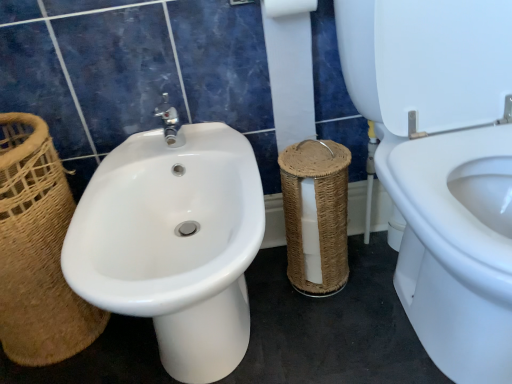
Describe the element at coordinates (456, 247) in the screenshot. The height and width of the screenshot is (384, 512). I see `white glossy bidet at left` at that location.

This screenshot has width=512, height=384. In order to click on woven brown basket at center in this screenshot , I will do `click(316, 215)`.

The height and width of the screenshot is (384, 512). What are the coordinates of `white glossy bidet at left` in the screenshot? It's located at pos(456,247).

From a real-world perspective, is white glossy bidet at center positioned over brown wicker basket at left based on gravity?

Actually, white glossy bidet at center is physically below brown wicker basket at left in the real world.

Looking at their sizes, would you say white glossy bidet at center is wider or thinner than brown wicker basket at left?

In the image, white glossy bidet at center appears to be wider than brown wicker basket at left.

Consider the image. Between white glossy bidet at center and brown wicker basket at left, which one appears on the right side from the viewer's perspective?

Positioned to the right is white glossy bidet at center.

Considering the positions of objects white glossy bidet at center and brown wicker basket at left in the image provided, who is behind, white glossy bidet at center or brown wicker basket at left?

brown wicker basket at left is more distant.

Which is behind, point (16, 237) or point (488, 352)?

Point (16, 237)

From a real-world perspective, who is located lower, brown wicker basket at left or white glossy bidet at left?

brown wicker basket at left, from a real-world perspective.

How much distance is there between brown wicker basket at left and white glossy bidet at left?

brown wicker basket at left and white glossy bidet at left are 77.49 centimeters apart.

How different are the orientations of brown wicker basket at left and white glossy bidet at left in degrees?

They differ by 1.55 degrees in their facing directions.

From the image's perspective, relative to white glossy bidet at center, is white paper at center above or below?

white paper at center is above white glossy bidet at center.

Considering the points (303, 60) and (166, 317), which point is in front, point (303, 60) or point (166, 317)?

The point (166, 317) is more forward.

Which object is further away from the camera, white paper at center or white glossy bidet at center?

white paper at center is more distant.

Which of these two, white paper at center or white glossy bidet at center, is wider?

white glossy bidet at center is wider.

From the image's perspective, which one is positioned higher, white glossy bidet at center or woven brown basket at center?

woven brown basket at center appears higher in the image.

Between white glossy bidet at center and woven brown basket at center, which one is positioned behind?

woven brown basket at center.

From a real-world perspective, which is physically above, white glossy bidet at center or woven brown basket at center?

In real-world perspective, white glossy bidet at center is above.

Consider the image. Is white glossy bidet at left facing away from woven brown basket at center?

white glossy bidet at left does not have its back to woven brown basket at center.

From the image's perspective, is white glossy bidet at left on top of woven brown basket at center?

Yes, from the image's perspective, white glossy bidet at left is on top of woven brown basket at center.

Which object is positioned more to the right, white glossy bidet at left or woven brown basket at center?

From the viewer's perspective, white glossy bidet at left appears more on the right side.

From a real-world perspective, which object stands above the other?

In real-world perspective, brown wicker basket at left is above.

Does brown wicker basket at left have a larger size compared to woven brown basket at center?

Yes, brown wicker basket at left is bigger than woven brown basket at center.

Would you say woven brown basket at center is part of brown wicker basket at left's contents?

No, woven brown basket at center is not a part of brown wicker basket at left.

In the image, is white paper at center on the left side or the right side of brown wicker basket at left?

Based on their positions, white paper at center is located to the right of brown wicker basket at left.

Who is more distant, white paper at center or brown wicker basket at left?

Positioned behind is white paper at center.

Is white paper at center facing away from brown wicker basket at left?

That's not correct — white paper at center is not looking away from brown wicker basket at left.

Between white paper at center and brown wicker basket at left, which one has larger width?

brown wicker basket at left is wider.

This screenshot has width=512, height=384. Find the location of `basket that appears behind the white glossy bidet at center`. basket that appears behind the white glossy bidet at center is located at coordinates (37, 250).

Where is `basket below the white glossy bidet at left (from the image's perspective)`? basket below the white glossy bidet at left (from the image's perspective) is located at coordinates point(37,250).

Which object lies nearer to the anchor point brown wicker basket at left, woven brown basket at center or white glossy bidet at left?

woven brown basket at center.

Considering their positions, is brown wicker basket at left positioned further to white glossy bidet at left than white glossy bidet at center?

brown wicker basket at left is positioned further to the anchor white glossy bidet at left.

Based on the photo, from the image, which object appears to be farther from woven brown basket at center, brown wicker basket at left or white glossy bidet at center?

The object further to woven brown basket at center is brown wicker basket at left.

From the image, which object appears to be nearer to woven brown basket at center, white glossy bidet at left or brown wicker basket at left?

Among the two, white glossy bidet at left is located nearer to woven brown basket at center.

Estimate the real-world distances between objects in this image. Which object is further from woven brown basket at center, brown wicker basket at left or white glossy bidet at left?

The object further to woven brown basket at center is brown wicker basket at left.

When comparing their distances from woven brown basket at center, does white paper at center or white glossy bidet at center seem closer?

white paper at center.

Estimate the real-world distances between objects in this image. Which object is closer to brown wicker basket at left, white glossy bidet at left or white paper at center?

white paper at center is closer to brown wicker basket at left.

Considering their positions, is white glossy bidet at left positioned closer to woven brown basket at center than white glossy bidet at center?

Based on the image, white glossy bidet at left appears to be nearer to woven brown basket at center.

You are a GUI agent. You are given a task and a screenshot of the screen. Output one action in this format:
    pyautogui.click(x=<x>, y=<y>)
    Task: Click on the toilet paper between brown wicker basket at left and white glossy bidet at left
    The height and width of the screenshot is (384, 512).
    Given the screenshot: What is the action you would take?
    pyautogui.click(x=290, y=68)

Locate an element on the screen. basket container situated between brown wicker basket at left and white glossy bidet at left from left to right is located at coordinates (316, 215).

Find the location of a particular element. sink between brown wicker basket at left and white paper at center in the horizontal direction is located at coordinates (173, 241).

At what (x,y) coordinates should I click in order to perform the action: click on toilet paper between white glossy bidet at center and white glossy bidet at left. Please return your answer as a coordinate pair (x, y). This screenshot has height=384, width=512. Looking at the image, I should click on (290, 68).